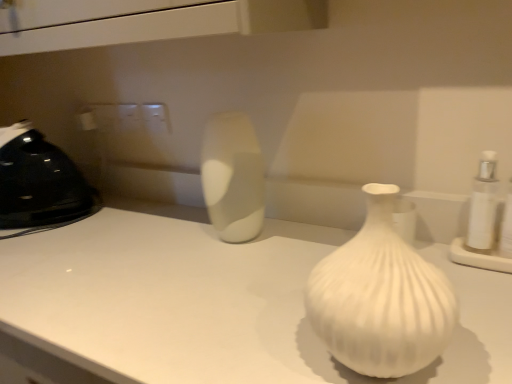
Locate an element on the screen. spots to the right of satin white vase at center, which is the second vase from front to back is located at coordinates [x=309, y=240].